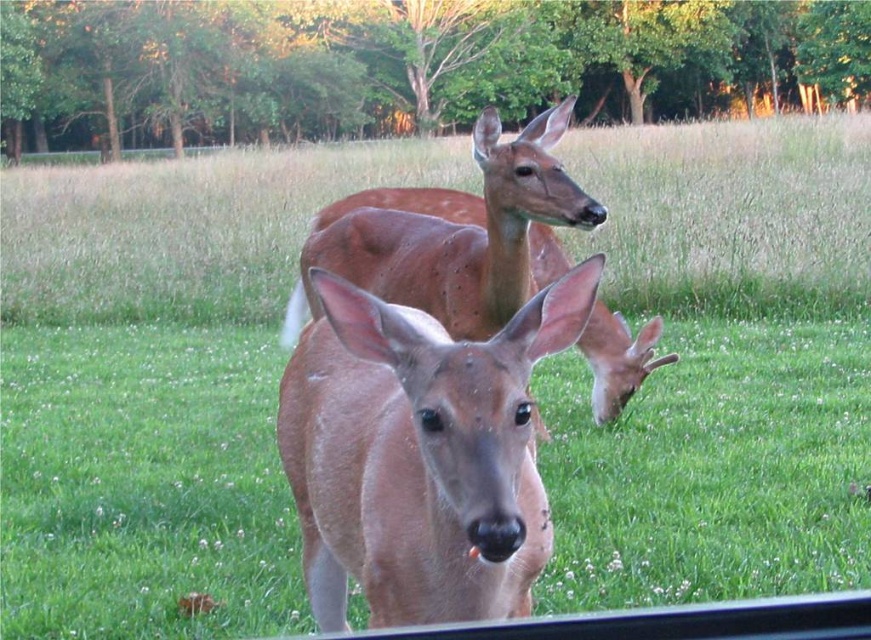
You are a wildlife photographer aiming to capture a closeup shot of the matte brown deer at center. Your camera has a maximum focus range of 1.5 meters. Can you take the photo without moving closer?

The matte brown deer at center is 1.59 meters away from camera. Since the maximum focus range is 1.5 meters, the camera cannot focus on the deer at that distance. You need to move closer to within 1.5 meters to take the photo.

You are standing in the field and want to locate the matte brown deer at center. What are the coordinates where you can find it?

The matte brown deer at center can be found at coordinates point (420, 454).